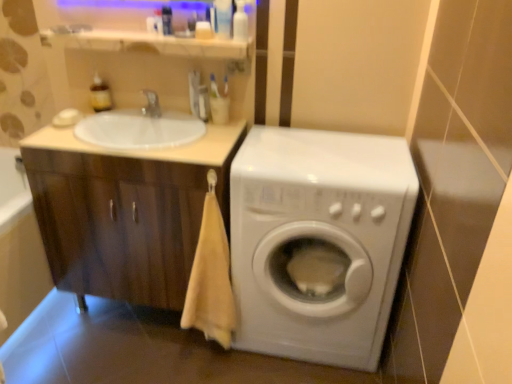
The image size is (512, 384). I want to click on vacant space that's between white matte soap at upper left, the first soap when ordered from top to bottom, and translucent plastic toothbrush at upper center, which appears as the third toiletry when viewed from the left, so click(x=144, y=122).